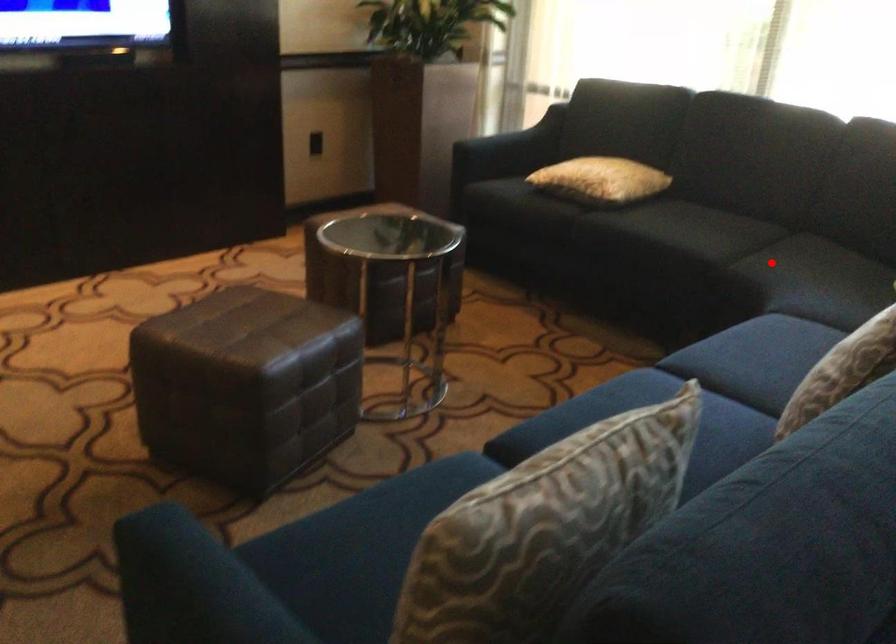
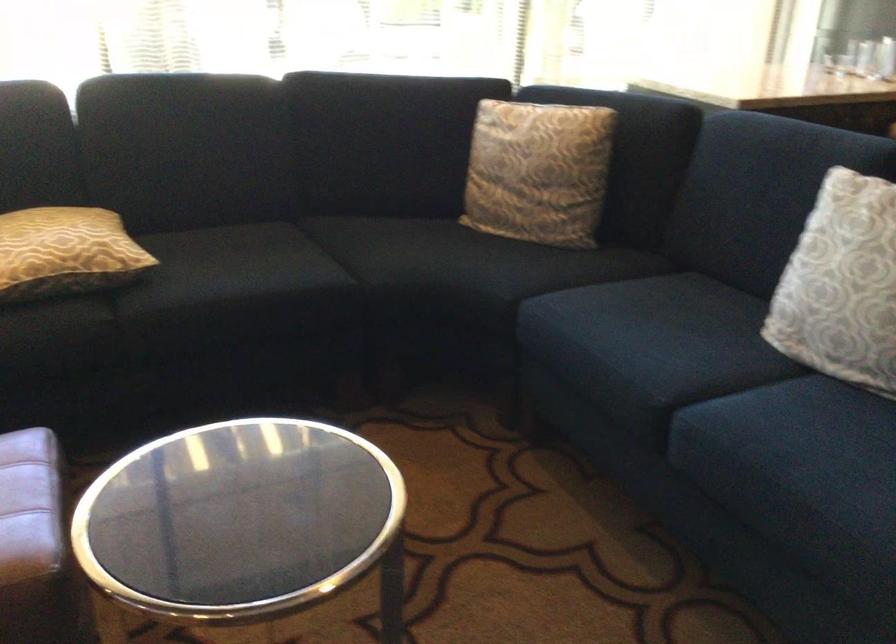
Where in the second image is the point corresponding to the highlighted location from the first image?

(391, 261)